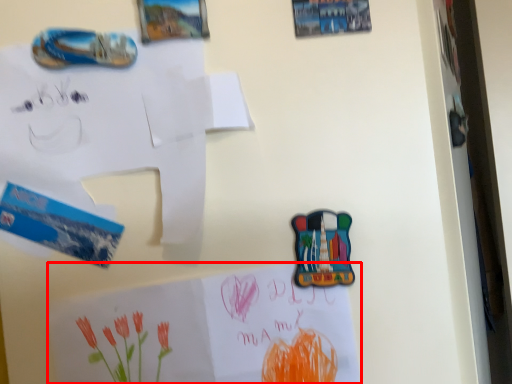
Question: From the image's perspective, where is paper (annotated by the red box) located in relation to paper in the image?

Choices:
 (A) above
 (B) below

Answer: (B)